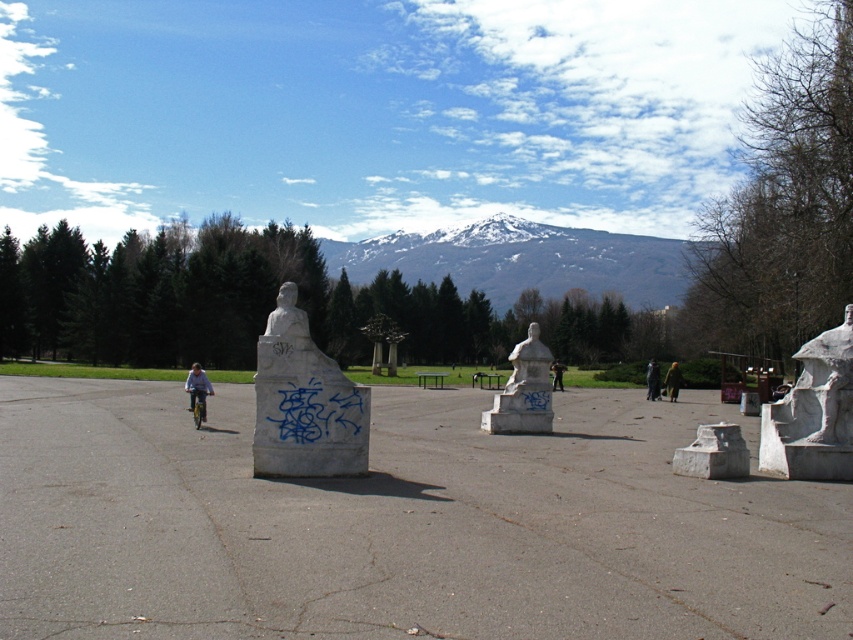
You are a photographer planning to capture the snowy rock mountain at upper center and the white stone statue at right in the same frame. Based on their heights, which object will appear larger in the photo?

The snowy rock mountain at upper center is taller than the white stone statue at right, so it will appear larger in the photo.

You are a tour guide leading a group through the park. You want to take your group from the light blue fabric jacket at left to the white stone bust at center. How far will you need to walk?

The distance between the light blue fabric jacket at left and the white stone bust at center is 17.25 meters, so you will need to walk 17.25 meters.

You are standing in the park and see the white stone bust at center and the light blue fabric jacket at left. Which object is positioned to the right of the other?

The white stone bust at center is to the right of the light blue fabric jacket at left.